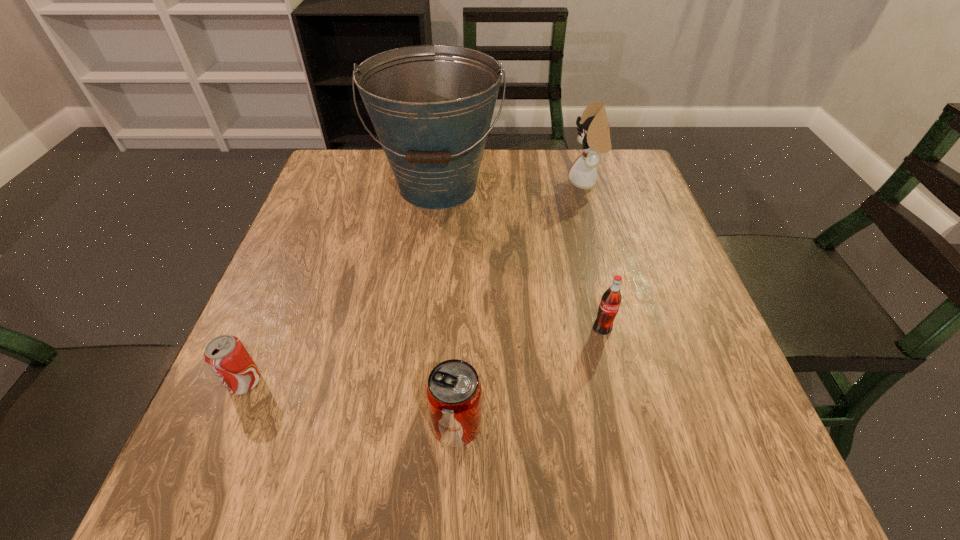
Find the location of `vacant space situated at the front face of the fourth shortest object`. vacant space situated at the front face of the fourth shortest object is located at coordinates (479, 183).

This screenshot has height=540, width=960. What are the coordinates of `vacant space located at the front face of the fourth shortest object` in the screenshot? It's located at (468, 183).

This screenshot has height=540, width=960. I want to click on vacant space located 0.100m on the label of the rightmost soda can, so click(615, 383).

This screenshot has width=960, height=540. I want to click on vacant space situated 0.320m on the right of the nearest soda can, so click(681, 425).

You are a GUI agent. You are given a task and a screenshot of the screen. Output one action in this format:
    pyautogui.click(x=<x>, y=<y>)
    Task: Click on the free region located 0.150m on the right of the shortest object
    
    Given the screenshot: What is the action you would take?
    pyautogui.click(x=348, y=382)

Find the location of `bucket that is positioned at the far edge`. bucket that is positioned at the far edge is located at coordinates (431, 106).

Find the location of a particular element. Image resolution: width=960 pixels, height=540 pixels. doll at the far edge is located at coordinates (595, 134).

Identify the location of object positioned at the near edge. The image size is (960, 540). (454, 394).

Where is `bucket situated at the left edge`? The height and width of the screenshot is (540, 960). bucket situated at the left edge is located at coordinates (431, 106).

At what (x,y) coordinates should I click in order to perform the action: click on soda can that is at the left edge. Please return your answer as a coordinate pair (x, y). The image size is (960, 540). Looking at the image, I should click on (227, 357).